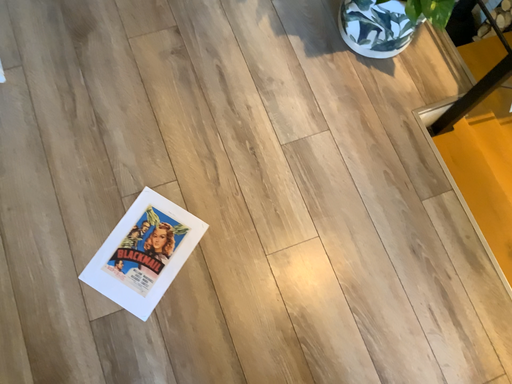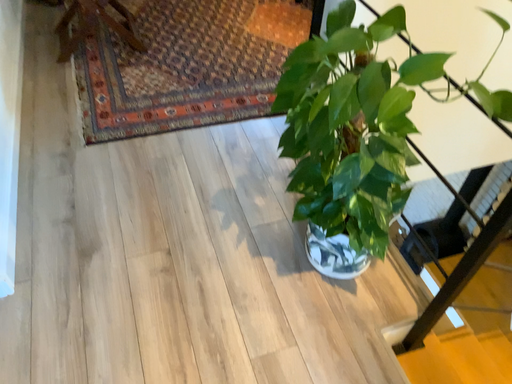
Question: Which way did the camera rotate in the video?

Choices:
 (A) rotated upward
 (B) rotated downward

Answer: (A)